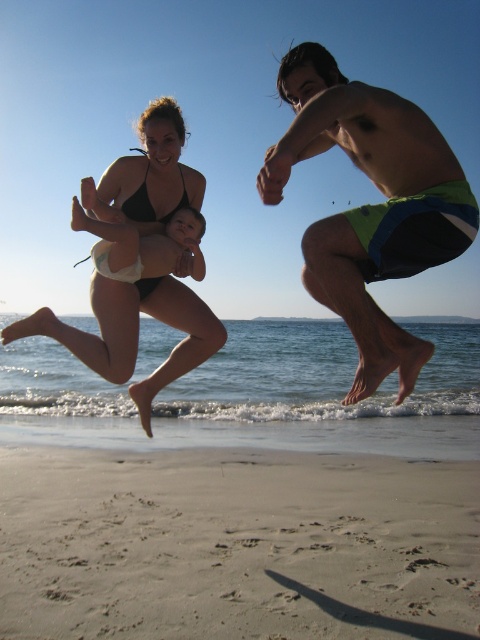
You are a photographer trying to capture the perfect shot of the beach scene. You notice the black matte bikini top at upper center and the black matte bikini at upper left. Which object is covering part of the other?

The black matte bikini top at upper center is positioned over the black matte bikini at upper left, so it is covering part of it.